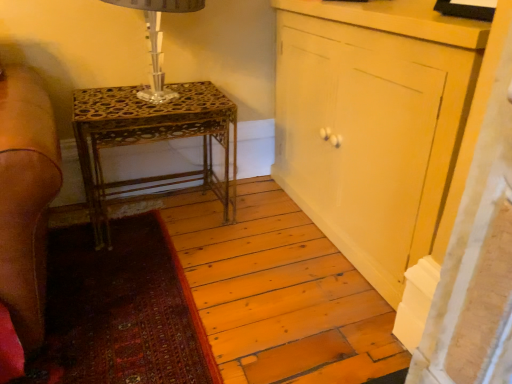
Question: Does matte yellow cabinet at center have a lesser width compared to clear glass table lamp at upper left?

Choices:
 (A) no
 (B) yes

Answer: (B)

Question: Is matte yellow cabinet at center bigger than clear glass table lamp at upper left?

Choices:
 (A) yes
 (B) no

Answer: (A)

Question: Considering the relative sizes of matte yellow cabinet at center and clear glass table lamp at upper left in the image provided, is matte yellow cabinet at center wider than clear glass table lamp at upper left?

Choices:
 (A) yes
 (B) no

Answer: (B)

Question: Is the depth of matte yellow cabinet at center less than that of clear glass table lamp at upper left?

Choices:
 (A) no
 (B) yes

Answer: (B)

Question: Is matte yellow cabinet at center behind clear glass table lamp at upper left?

Choices:
 (A) no
 (B) yes

Answer: (A)

Question: Is matte yellow cabinet at center outside clear glass table lamp at upper left?

Choices:
 (A) yes
 (B) no

Answer: (A)

Question: From a real-world perspective, is matte yellow cabinet at center below gold metallic table at center?

Choices:
 (A) no
 (B) yes

Answer: (A)

Question: Considering the relative sizes of matte yellow cabinet at center and gold metallic table at center in the image provided, is matte yellow cabinet at center taller than gold metallic table at center?

Choices:
 (A) yes
 (B) no

Answer: (A)

Question: Is matte yellow cabinet at center oriented away from gold metallic table at center?

Choices:
 (A) no
 (B) yes

Answer: (A)

Question: Can you confirm if matte yellow cabinet at center is bigger than gold metallic table at center?

Choices:
 (A) yes
 (B) no

Answer: (A)

Question: From the image's perspective, is matte yellow cabinet at center under gold metallic table at center?

Choices:
 (A) yes
 (B) no

Answer: (B)

Question: Is matte yellow cabinet at center thinner than gold metallic table at center?

Choices:
 (A) no
 (B) yes

Answer: (B)

Question: Does clear glass table lamp at upper left have a lesser height compared to matte yellow cabinet at center?

Choices:
 (A) yes
 (B) no

Answer: (A)